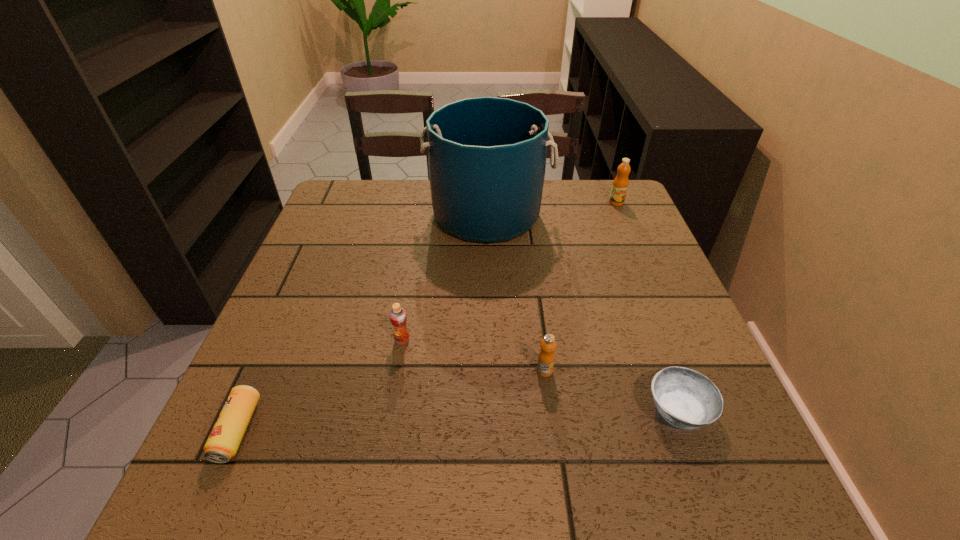
Find the location of a particular element. This screenshot has height=540, width=960. ashtray present at the right edge is located at coordinates (685, 398).

The height and width of the screenshot is (540, 960). Find the location of `object that is at the near left corner`. object that is at the near left corner is located at coordinates (222, 444).

This screenshot has width=960, height=540. Find the location of `object that is at the far right corner`. object that is at the far right corner is located at coordinates (620, 184).

Locate an element on the screen. This screenshot has height=540, width=960. blank space at the far edge of the desktop is located at coordinates (564, 212).

Identify the location of free space at the near edge. (524, 477).

Locate an element on the screen. The width and height of the screenshot is (960, 540). vacant position at the left edge of the desktop is located at coordinates (304, 349).

Locate an element on the screen. This screenshot has height=540, width=960. free space at the far left corner of the desktop is located at coordinates (338, 212).

The height and width of the screenshot is (540, 960). In the image, there is a desktop. Find the location of `vacant space at the near left corner`. vacant space at the near left corner is located at coordinates (217, 483).

In order to click on free space at the far right corner of the desktop in this screenshot , I will do `click(602, 196)`.

What are the coordinates of `unoccupied position between the tallest orange juice and the nearest orange juice` in the screenshot? It's located at (581, 287).